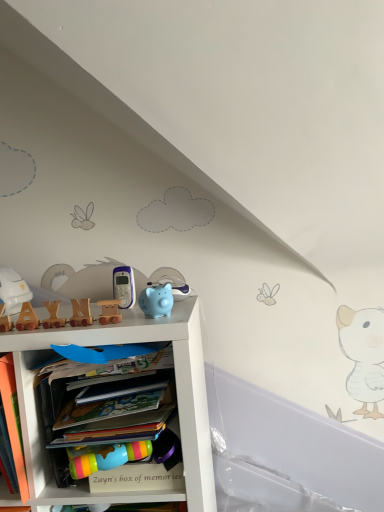
This screenshot has height=512, width=384. In order to click on spots to the right of wooden letter blocks at upper left, the sixth toy in the right-to-left sequence in this screenshot , I will do `click(86, 321)`.